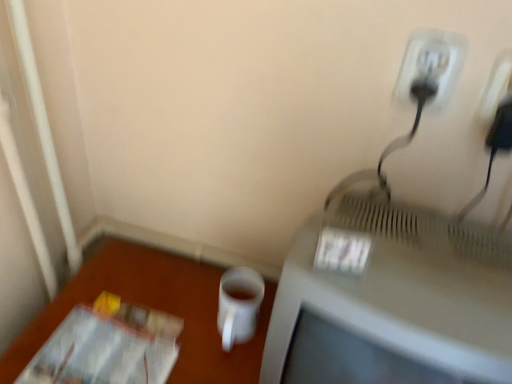
Question: Is transparent plastic magazine at lower left in front of or behind white matte mug at lower center in the image?

Choices:
 (A) front
 (B) behind

Answer: (A)

Question: In the image, is transparent plastic magazine at lower left on the left side or the right side of white matte mug at lower center?

Choices:
 (A) right
 (B) left

Answer: (B)

Question: Which of these objects is positioned farthest from the black plastic plug at upper right?

Choices:
 (A) matte gray television at right
 (B) white matte mug at lower center
 (C) white matte cup at lower right
 (D) white plastic outlet at upper right
 (E) transparent plastic magazine at lower left

Answer: (E)

Question: Which object is the closest to the white plastic outlet at upper right?

Choices:
 (A) matte gray television at right
 (B) black plastic plug at upper right
 (C) white matte cup at lower right
 (D) white matte mug at lower center
 (E) transparent plastic magazine at lower left

Answer: (B)